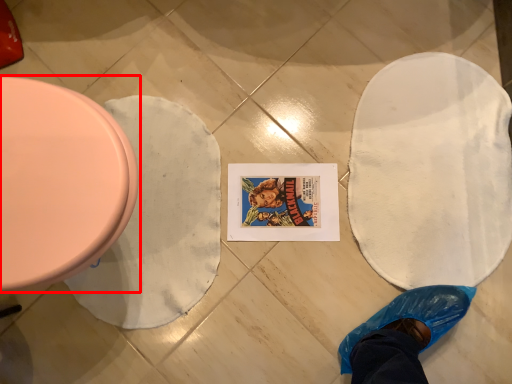
Question: Considering the relative positions of toilet (annotated by the red box) and blanket in the image provided, where is toilet (annotated by the red box) located with respect to the staircase?

Choices:
 (A) left
 (B) right

Answer: (A)